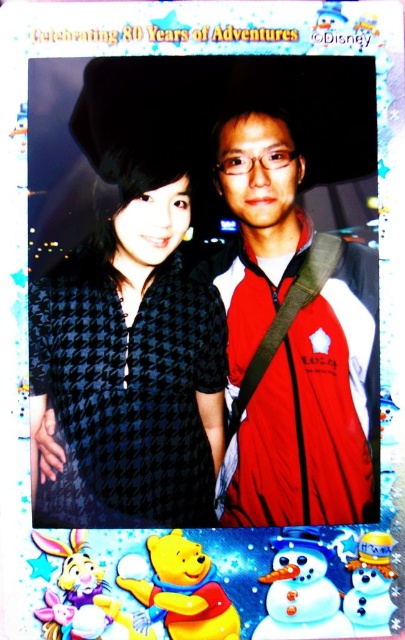
Can you confirm if black houndstooth dress at center is taller than snow white snowman at lower center?

Yes, black houndstooth dress at center is taller than snow white snowman at lower center.

Is point (170, 390) more distant than point (211, 612)?

That is True.

At what (x,y) coordinates should I click in order to perform the action: click on black houndstooth dress at center. Please return your answer as a coordinate pair (x, y). The image size is (405, 640). Looking at the image, I should click on (134, 355).

Who is lower down, snow white snowman at lower center or white frosty snowman at lower right?

snow white snowman at lower center is below.

Between point (142, 618) and point (388, 540), which one is positioned behind?

The point (388, 540) is behind.

In order to click on snow white snowman at lower center in this screenshot , I will do `click(183, 592)`.

Does point (170, 275) lie in front of point (319, 612)?

No, it is not.

Which is more to the left, black houndstooth dress at center or white matte snowman at center?

black houndstooth dress at center is more to the left.

At what (x,y) coordinates should I click in order to perform the action: click on black houndstooth dress at center. Please return your answer as a coordinate pair (x, y). The height and width of the screenshot is (640, 405). Looking at the image, I should click on (134, 355).